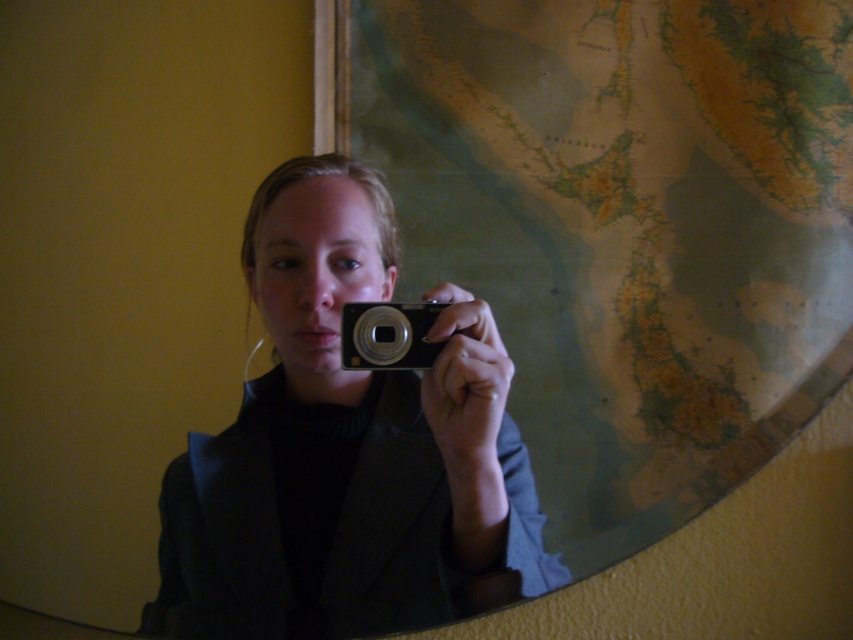
What are the coordinates of the matte black camera at center?

The matte black camera at center is located at coordinates point (347, 449).

You are a photographer trying to take a clear selfie using either the matte black camera at center or the silver metallic camera at center. Which camera is positioned closer to your face for the selfie?

The matte black camera at center is positioned closer to your face since it is in front of the silver metallic camera at center.

You are a photographer trying to capture a selfie with both cameras visible in the mirror reflection. Given that the mirror is 1 meter wide, can both the matte black camera at center and the silver metallic camera at center fit side by side in the mirror?

The matte black camera at center and the silver metallic camera at center are only 14.10 centimeters apart, so they can easily fit side by side within the 1 meter width of the mirror.